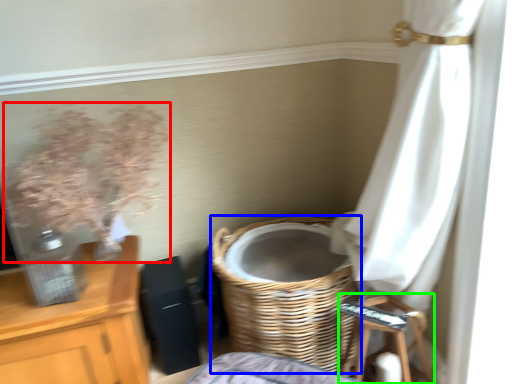
Question: Which object is positioned farthest from floral arrangement (highlighted by a red box)? Select from basket (highlighted by a blue box) and step stool (highlighted by a green box).

Choices:
 (A) basket
 (B) step stool

Answer: (B)